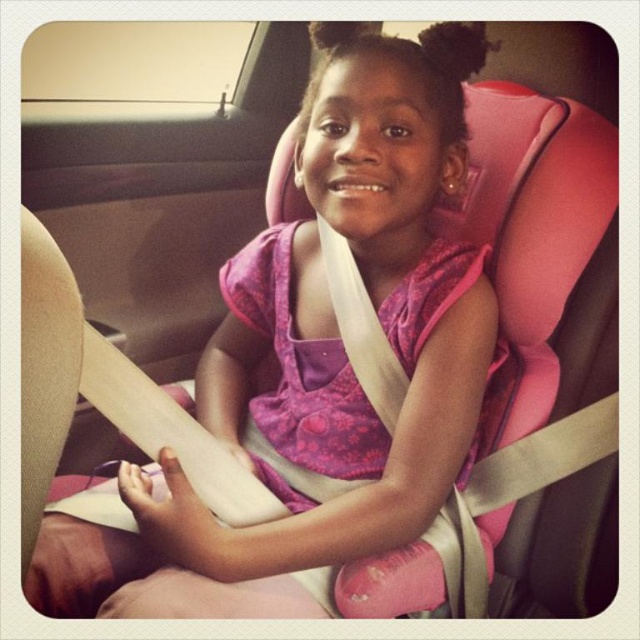
You are a safety inspector checking the car seat setup. You need to ensure that the pink fabric dress at center is not interfering with the seatbelt. Based on the coordinates provided, is the dress positioned in a way that allows the seatbelt to function properly?

The pink fabric dress at center is located at point (316, 364), which should not interfere with the seatbelt as long as it is positioned correctly over the lap and chest areas. The coordinates indicate it is centered, so the seatbelt should function properly if adjusted according to safety guidelines.

You are a safety inspector checking the distance between the pink fabric dress at center and the child in the car seat. According to safety regulations, the minimum safe distance between a child and any loose fabric is 30 inches. Is the current distance compliant with the safety standards?

The pink fabric dress at center and the child are 28.88 inches apart, which is less than the required 30 inches. This does not meet the safety standards, so adjustments are needed to increase the distance.